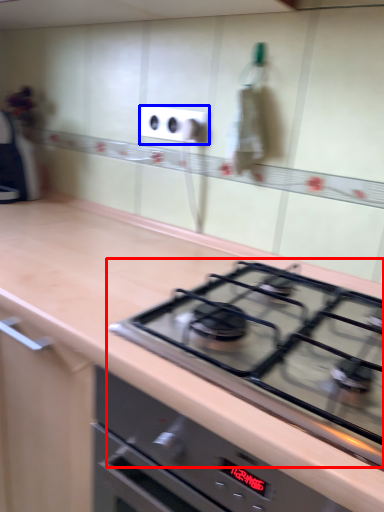
Question: Among these objects, which one is farthest to the camera, gas stove (highlighted by a red box) or electric outlet (highlighted by a blue box)?

Choices:
 (A) gas stove
 (B) electric outlet

Answer: (B)